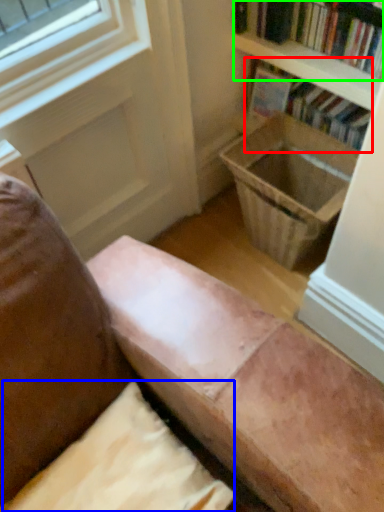
Question: Considering the real-world distances, which object is closest to book (highlighted by a red box)? pillow (highlighted by a blue box) or book (highlighted by a green box).

Choices:
 (A) pillow
 (B) book

Answer: (B)